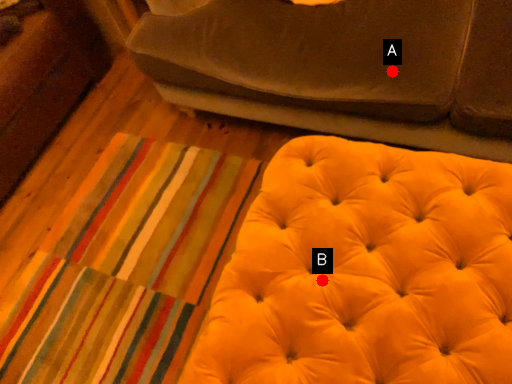
Question: Two points are circled on the image, labeled by A and B beside each circle. Which point is closer to the camera taking this photo?

Choices:
 (A) A is closer
 (B) B is closer

Answer: (B)